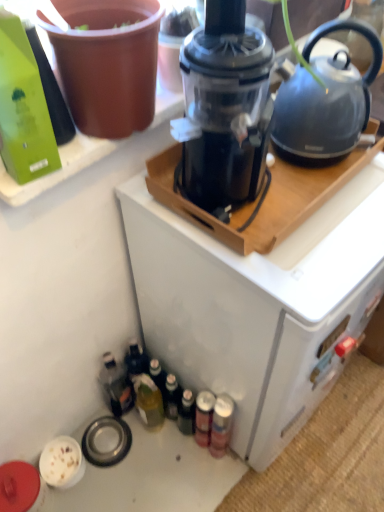
Question: From a real-world perspective, is matte gray kettle at upper right beneath green matte bottle at upper left, the first bottle in the top-to-bottom sequence?

Choices:
 (A) no
 (B) yes

Answer: (B)

Question: Is green matte bottle at upper left, which appears as the first bottle when viewed from the front, at the back of matte gray kettle at upper right?

Choices:
 (A) no
 (B) yes

Answer: (A)

Question: Can you confirm if matte gray kettle at upper right is shorter than green matte bottle at upper left, the third bottle when ordered from bottom to top?

Choices:
 (A) yes
 (B) no

Answer: (B)

Question: Would you say matte gray kettle at upper right is a long distance from green matte bottle at upper left, the third bottle when ordered from bottom to top?

Choices:
 (A) no
 (B) yes

Answer: (A)

Question: Is matte gray kettle at upper right at the right side of green matte bottle at upper left, the third bottle positioned from the back?

Choices:
 (A) no
 (B) yes

Answer: (B)

Question: Looking at their shapes, would you say translucent glass bottle at lower left, which is counted as the second bottle, starting from the front, is wider or thinner than translucent plastic bottle at lower left, which appears as the first bottle when viewed from the back?

Choices:
 (A) wide
 (B) thin

Answer: (B)

Question: Is translucent glass bottle at lower left, which is counted as the second bottle, starting from the front, taller or shorter than translucent plastic bottle at lower left, arranged as the 2th bottle when ordered from the bottom?

Choices:
 (A) tall
 (B) short

Answer: (B)

Question: Does point click(x=142, y=394) appear closer or farther from the camera than point click(x=125, y=382)?

Choices:
 (A) farther
 (B) closer

Answer: (A)

Question: From a real-world perspective, is translucent glass bottle at lower left, the 3th bottle in the top-to-bottom sequence, positioned above or below translucent plastic bottle at lower left, which is the third bottle in front-to-back order?

Choices:
 (A) above
 (B) below

Answer: (A)

Question: In the image, is matte gray kettle at upper right positioned in front of or behind black plastic blender at center?

Choices:
 (A) behind
 (B) front

Answer: (A)

Question: Looking at their shapes, would you say matte gray kettle at upper right is wider or thinner than black plastic blender at center?

Choices:
 (A) wide
 (B) thin

Answer: (B)

Question: Does point (301, 97) appear closer or farther from the camera than point (213, 194)?

Choices:
 (A) closer
 (B) farther

Answer: (B)

Question: From a real-world perspective, relative to black plastic blender at center, is matte gray kettle at upper right vertically above or below?

Choices:
 (A) below
 (B) above

Answer: (A)

Question: Is green matte bottle at upper left, the third bottle when ordered from bottom to top, taller or shorter than translucent glass bottle at lower left, which ranks as the first bottle in bottom-to-top order?

Choices:
 (A) tall
 (B) short

Answer: (B)

Question: Is green matte bottle at upper left, the third bottle when ordered from bottom to top, in front of or behind translucent glass bottle at lower left, the 3th bottle in the top-to-bottom sequence, in the image?

Choices:
 (A) behind
 (B) front

Answer: (B)